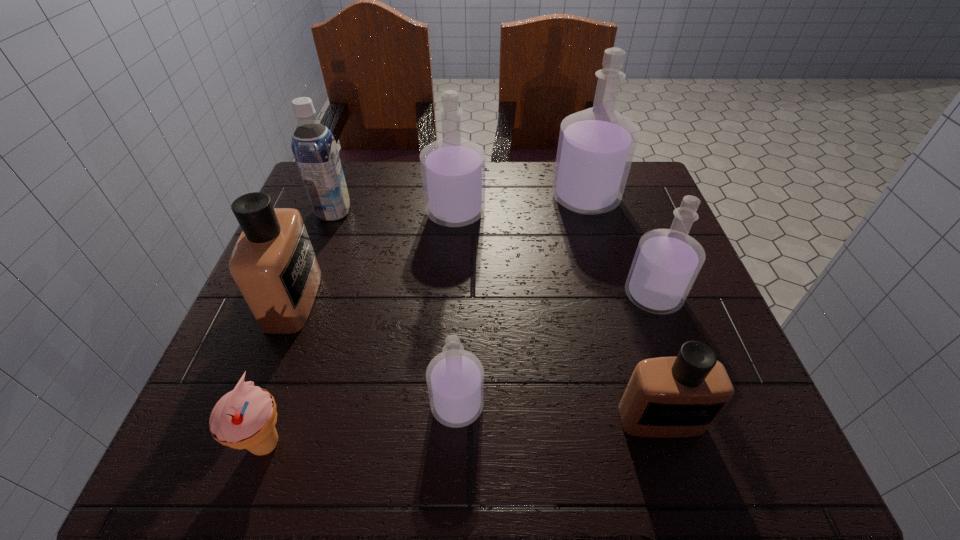
Find the location of a particular element. the tallest object is located at coordinates (596, 146).

The height and width of the screenshot is (540, 960). I want to click on the biggest purple perfume, so click(x=596, y=146).

I want to click on the second biggest purple perfume, so click(x=453, y=169).

Image resolution: width=960 pixels, height=540 pixels. I want to click on soya milk, so click(x=314, y=147).

Find the location of `the second nearest purple perfume`. the second nearest purple perfume is located at coordinates (667, 262).

What are the coordinates of `the farther beige perfume` in the screenshot? It's located at (273, 264).

Find the location of `the left beige perfume`. the left beige perfume is located at coordinates (273, 264).

At what (x,y) coordinates should I click in order to perform the action: click on the smallest purple perfume. Please return your answer as a coordinate pair (x, y). Looking at the image, I should click on (455, 378).

I want to click on the nearer beige perfume, so click(x=666, y=397).

You are a GUI agent. You are given a task and a screenshot of the screen. Output one action in this format:
    pyautogui.click(x=<x>, y=<y>)
    Task: Click on the smaller beige perfume
    The height and width of the screenshot is (540, 960).
    Given the screenshot: What is the action you would take?
    pyautogui.click(x=666, y=397)